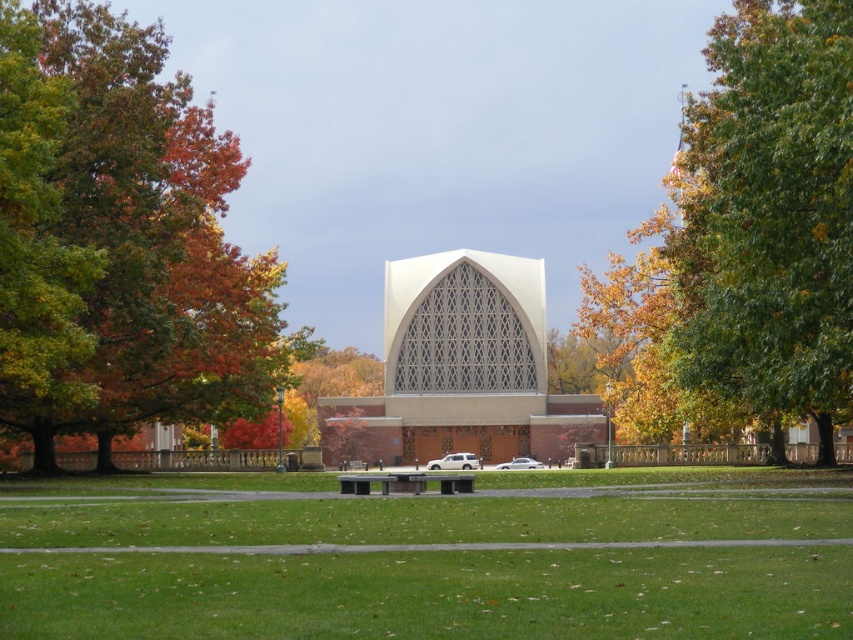
Question: Can you confirm if autumn leaves at left is positioned below metallic gray park bench at center?

Choices:
 (A) yes
 (B) no

Answer: (B)

Question: Which object is the farthest from the autumn leaves at left?

Choices:
 (A) yellow-green foliage at center
 (B) metallic gray park bench at center
 (C) smooth gray bench at center
 (D) wooden park bench at center

Answer: (A)

Question: Can you confirm if autumn leaves at left is positioned to the right of white matte suv at center?

Choices:
 (A) no
 (B) yes

Answer: (A)

Question: Is wooden park bench at center to the right of smooth gray bench at center from the viewer's perspective?

Choices:
 (A) no
 (B) yes

Answer: (B)

Question: Based on their relative distances, which object is nearer to the white glass church at center?

Choices:
 (A) autumn leaves at left
 (B) green grass at center

Answer: (A)

Question: Which of the following is the farthest from the observer?

Choices:
 (A) white glass church at center
 (B) white glossy car at center

Answer: (A)